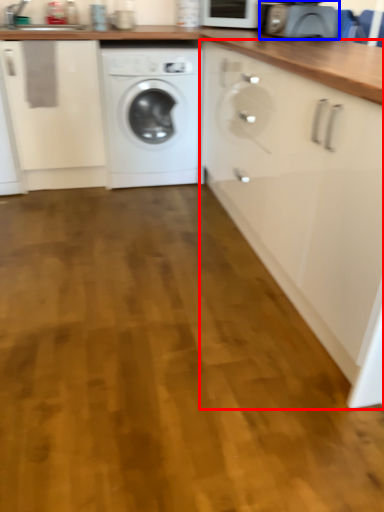
Question: Which of the following is the farthest to the observer, cabinetry (highlighted by a red box) or appliance (highlighted by a blue box)?

Choices:
 (A) cabinetry
 (B) appliance

Answer: (B)